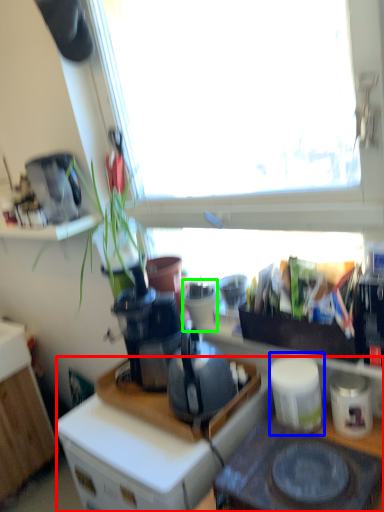
Question: Which object is positioned closest to desk (highlighted by a red box)? Select from appliance (highlighted by a blue box) and appliance (highlighted by a green box).

Choices:
 (A) appliance
 (B) appliance

Answer: (A)